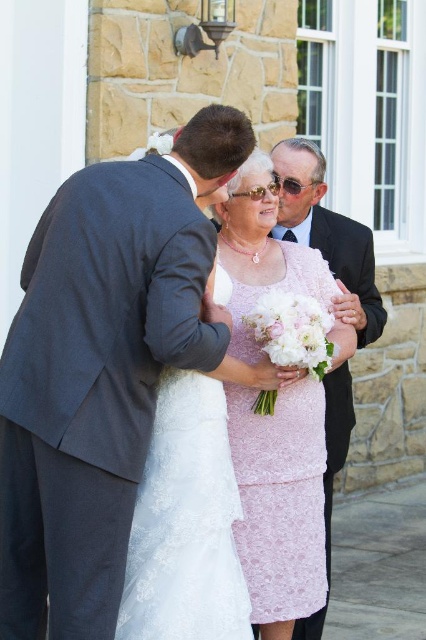
You are a photographer at a wedding and need to position two subjects in the frame. The pink lace dress at center belongs to the bride, and the matte black suit at upper center is the groom. Based on their positions and the scene description, which subject is closer to the camera?

The pink lace dress at center is closer to the camera than the matte black suit at upper center because it is thinner, indicating it is in front.